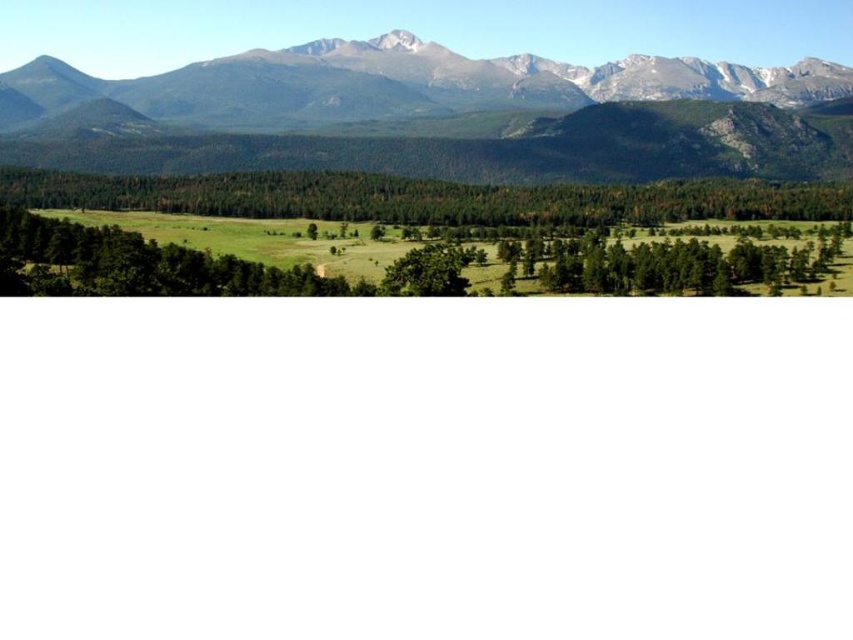
Is rocky gray mountain range at upper center positioned before green matte forest at center?

No, rocky gray mountain range at upper center is behind green matte forest at center.

Which is more to the left, rocky gray mountain range at upper center or green matte forest at center?

rocky gray mountain range at upper center

Which is in front, point (519, 106) or point (428, 192)?

Point (428, 192) is more forward.

The image size is (853, 640). What are the coordinates of `rocky gray mountain range at upper center` in the screenshot? It's located at (401, 84).

Is the position of green matte forest at center less distant than that of green matte tree at center?

No.

Does green matte forest at center have a lesser height compared to green matte tree at center?

In fact, green matte forest at center may be taller than green matte tree at center.

Does point (380, 176) come farther from viewer compared to point (437, 292)?

Yes.

The width and height of the screenshot is (853, 640). I want to click on green matte forest at center, so click(x=425, y=198).

Between point (529, 104) and point (457, 264), which one is positioned in front?

Point (457, 264) is in front.

Is rocky gray mountain range at upper center to the left of green matte tree at center from the viewer's perspective?

Correct, you'll find rocky gray mountain range at upper center to the left of green matte tree at center.

This screenshot has height=640, width=853. I want to click on rocky gray mountain range at upper center, so click(401, 84).